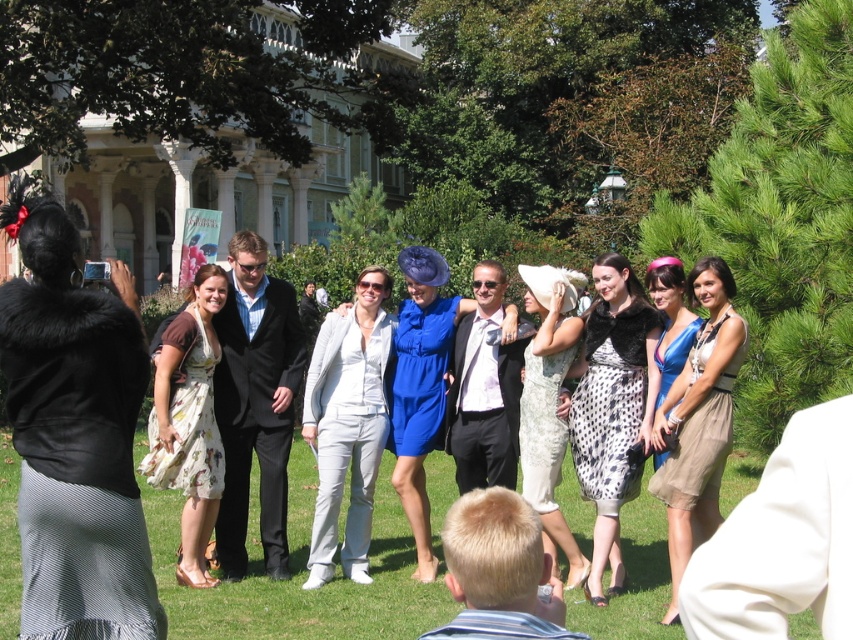
From the picture: Can you confirm if black fur coat at left is shorter than dotted fabric dress at center?

Correct, black fur coat at left is not as tall as dotted fabric dress at center.

Does point (67, 298) come behind point (596, 314)?

That is False.

The width and height of the screenshot is (853, 640). I want to click on black fur coat at left, so click(74, 435).

Locate an element on the screen. This screenshot has height=640, width=853. beige chiffon dress at center is located at coordinates (698, 420).

Which of these two, beige chiffon dress at center or shiny blue dress at center, stands taller?

beige chiffon dress at center is taller.

Between point (699, 481) and point (657, 291), which one is positioned behind?

The point (657, 291) is more distant.

At what (x,y) coordinates should I click in order to perform the action: click on beige chiffon dress at center. Please return your answer as a coordinate pair (x, y). The height and width of the screenshot is (640, 853). Looking at the image, I should click on (698, 420).

Which of these two, light gray suit at center or white lace dress at center, stands taller?

With more height is light gray suit at center.

Measure the distance between point [361,449] and camera.

13.02 meters

Is point (335, 490) farther from camera compared to point (546, 544)?

Yes, it is.

Identify the location of light gray suit at center. The width and height of the screenshot is (853, 640). (347, 422).